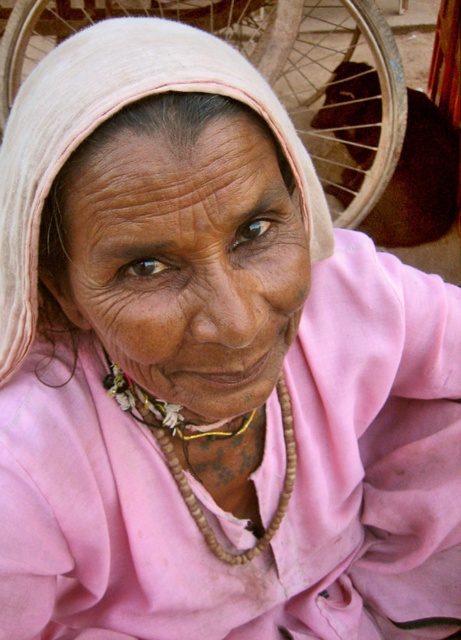
Can you confirm if brown matte face at center is positioned below wooden beads at center?

Actually, brown matte face at center is above wooden beads at center.

Between point (133, 192) and point (185, 435), which one is positioned in front?

Positioned in front is point (133, 192).

Find the location of a particular element. This screenshot has width=461, height=640. brown matte face at center is located at coordinates (188, 260).